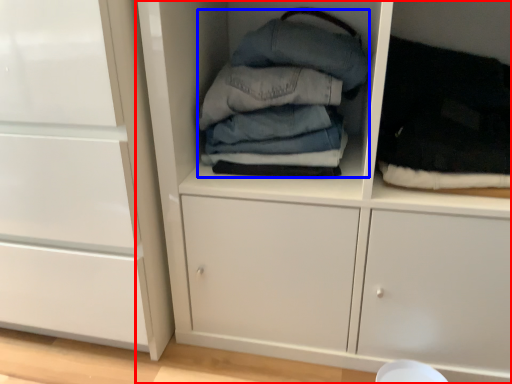
Question: Which object appears closest to the camera in this image, cupboard (highlighted by a red box) or clothing (highlighted by a blue box)?

Choices:
 (A) cupboard
 (B) clothing

Answer: (A)